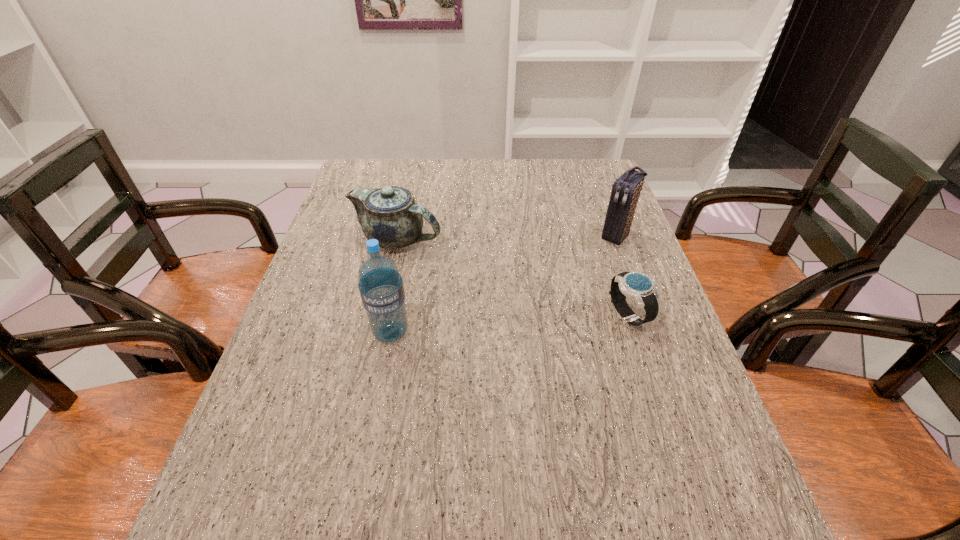
Find the location of a particular element. the tallest object is located at coordinates (381, 288).

Where is `watch`? The width and height of the screenshot is (960, 540). watch is located at coordinates (638, 286).

Locate an element on the screen. clutch bag is located at coordinates (626, 189).

Where is `the third tallest object`? The image size is (960, 540). the third tallest object is located at coordinates (390, 215).

At what (x,y) coordinates should I click in order to perform the action: click on free space located on the front of the water bottle. Please return your answer as a coordinate pair (x, y). The image size is (960, 540). Looking at the image, I should click on (383, 370).

Identify the location of vacant region located 0.160m on the back of the watch. The image size is (960, 540). (609, 255).

Identify the location of vacant space situated with the zip open on the second tallest object. 563,295.

Where is `free space located with the zip open on the second tallest object`? This screenshot has height=540, width=960. free space located with the zip open on the second tallest object is located at coordinates (582, 274).

I want to click on vacant point located 0.070m with the zip open on the second tallest object, so click(x=597, y=259).

At what (x,y) coordinates should I click in order to perform the action: click on blank space located from the spout of the second shortest object. Please return your answer as a coordinate pair (x, y). The height and width of the screenshot is (540, 960). Looking at the image, I should click on (472, 277).